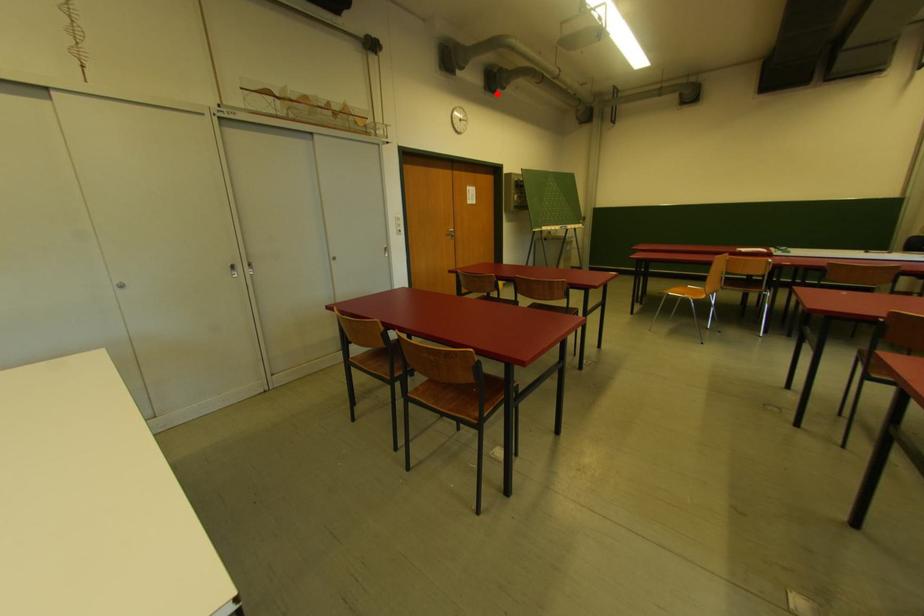
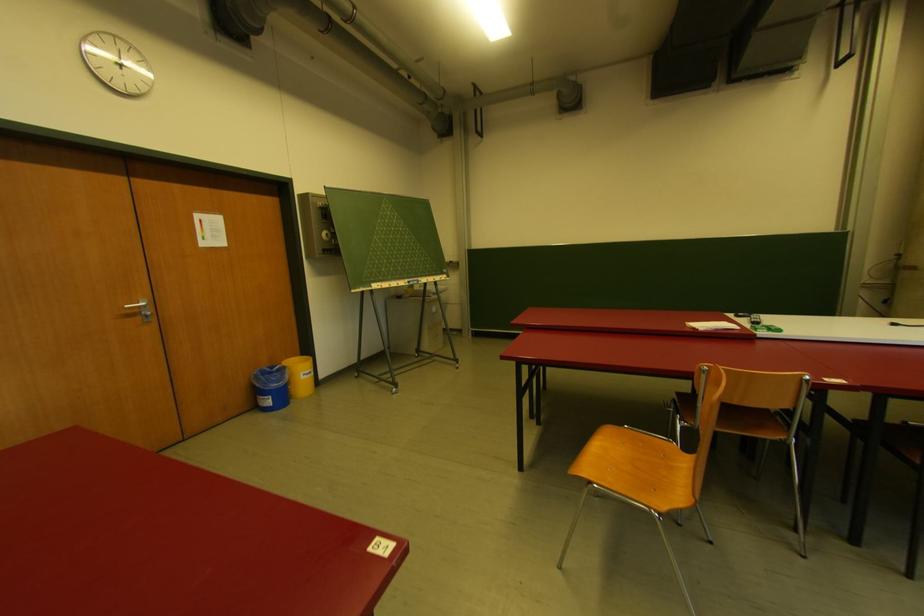
Find the pixel in the second image that matches the highlighted location in the first image.

(246, 43)